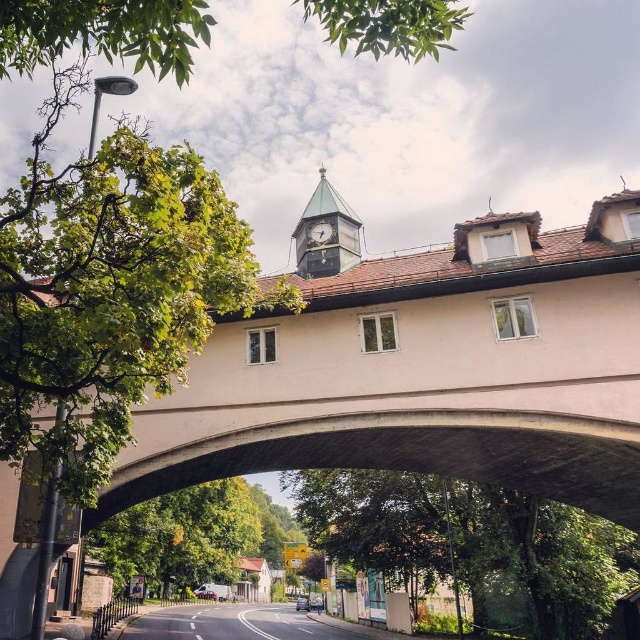
Does smooth concrete bridge at center have a smaller size compared to green glass clock tower at upper center?

No, smooth concrete bridge at center is not smaller than green glass clock tower at upper center.

Is point (403, 321) farther from viewer compared to point (332, 240)?

No, it is in front of (332, 240).

You are a GUI agent. You are given a task and a screenshot of the screen. Output one action in this format:
    pyautogui.click(x=<x>, y=<y>)
    Task: Click on the smooth concrete bridge at center
    The width and height of the screenshot is (640, 640).
    Given the screenshot: What is the action you would take?
    pyautogui.click(x=426, y=371)

Which of these two, smooth concrete bridge at center or metallic clock at center, stands shorter?

metallic clock at center

Can you confirm if smooth concrete bridge at center is wider than metallic clock at center?

Correct, the width of smooth concrete bridge at center exceeds that of metallic clock at center.

Between point (381, 304) and point (316, 241), which one is positioned behind?

Positioned behind is point (316, 241).

You are a GUI agent. You are given a task and a screenshot of the screen. Output one action in this format:
    pyautogui.click(x=<x>, y=<y>)
    Task: Click on the smooth concrete bridge at center
    This screenshot has width=640, height=640.
    Given the screenshot: What is the action you would take?
    pyautogui.click(x=426, y=371)

Where is `green glass clock tower at upper center`? The width and height of the screenshot is (640, 640). green glass clock tower at upper center is located at coordinates (324, 234).

What do you see at coordinates (324, 234) in the screenshot? I see `green glass clock tower at upper center` at bounding box center [324, 234].

Image resolution: width=640 pixels, height=640 pixels. Describe the element at coordinates (324, 234) in the screenshot. I see `green glass clock tower at upper center` at that location.

Where is `green glass clock tower at upper center`? green glass clock tower at upper center is located at coordinates (324, 234).